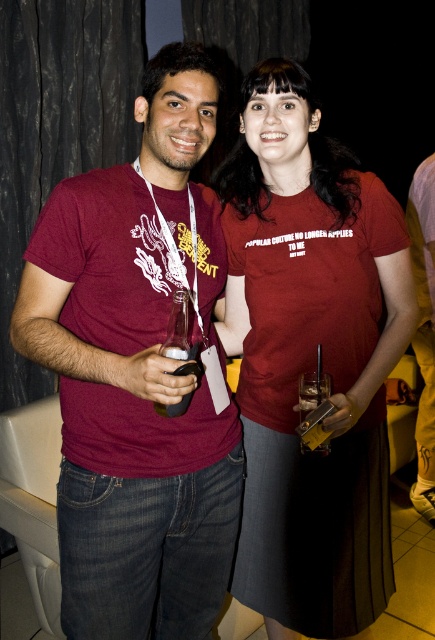
Which is below, matte maroon t-shirt at center or clear glass bottle at center?

matte maroon t-shirt at center

Can you confirm if matte maroon t-shirt at center is positioned to the right of clear glass bottle at center?

No, matte maroon t-shirt at center is not to the right of clear glass bottle at center.

Locate an element on the screen. Image resolution: width=435 pixels, height=640 pixels. matte maroon t-shirt at center is located at coordinates (127, 420).

Find the location of a particular element. matte maroon t-shirt at center is located at coordinates (127, 420).

Is matte red t-shirt at center closer to the viewer compared to clear glass bottle at center?

No, it is not.

Is matte red t-shirt at center shorter than clear glass bottle at center?

Incorrect, matte red t-shirt at center's height does not fall short of clear glass bottle at center's.

Is point (328, 339) in front of point (184, 316)?

No, it is not.

The width and height of the screenshot is (435, 640). I want to click on matte red t-shirt at center, so click(311, 358).

Does matte maroon t-shirt at center lie behind matte red t-shirt at center?

No.

Between matte maroon t-shirt at center and matte red t-shirt at center, which one is positioned lower?

Positioned lower is matte red t-shirt at center.

Which is behind, point (120, 355) or point (257, 340)?

The point (257, 340) is behind.

Locate an element on the screen. The width and height of the screenshot is (435, 640). matte maroon t-shirt at center is located at coordinates click(x=127, y=420).